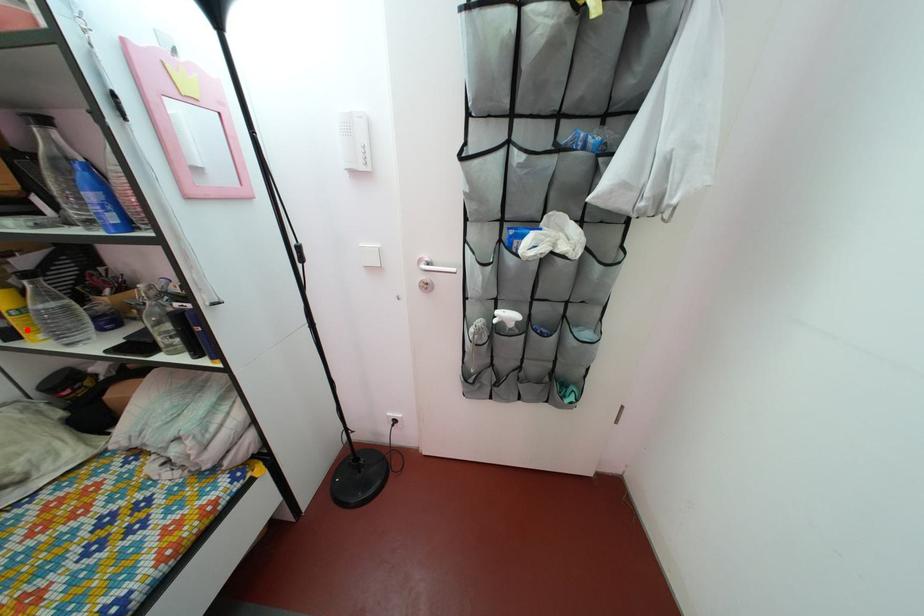
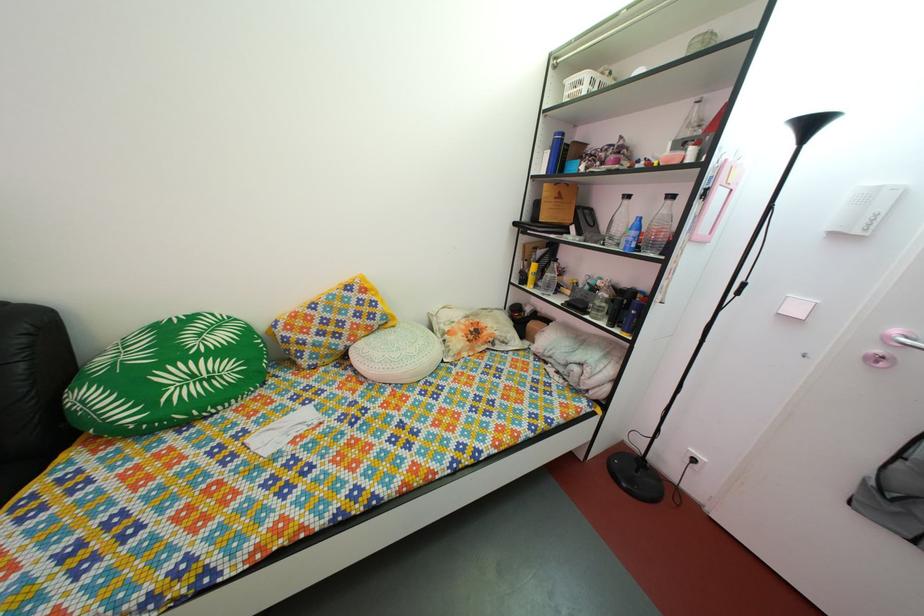
Find the pixel in the second image that matches the highlighted location in the first image.

(540, 286)